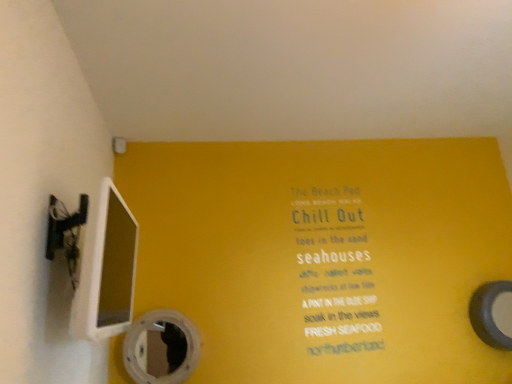
How much space does transparent plastic mirror at lower center, which is the 2th mirror from back to front, occupy horizontally?

transparent plastic mirror at lower center, which is the 2th mirror from back to front, is 6.31 inches in width.

Locate an element on the screen. transparent plastic mirror at lower center, which is the second mirror from right to left is located at coordinates (161, 348).

In order to face transparent plastic mirror at lower center, the first mirror from the front, should I rotate leftwards or rightwards?

Rotate your view left by about 12.433°.

Image resolution: width=512 pixels, height=384 pixels. What do you see at coordinates (161, 348) in the screenshot?
I see `transparent plastic mirror at lower center, which is the second mirror from right to left` at bounding box center [161, 348].

Measure the distance between point (505, 313) and camera.

The distance of point (505, 313) from camera is 8.27 feet.

Identify the location of smooth gray mirror at right, acting as the 1th mirror starting from the back. This screenshot has height=384, width=512. (493, 314).

What do you see at coordinates (493, 314) in the screenshot?
I see `smooth gray mirror at right, acting as the 1th mirror starting from the back` at bounding box center [493, 314].

The width and height of the screenshot is (512, 384). What are the coordinates of `transparent plastic mirror at lower center, which is the second mirror from right to left` in the screenshot? It's located at (161, 348).

Considering the relative positions of smooth gray mirror at right, placed as the second mirror when sorted from front to back, and transparent plastic mirror at lower center, which is the 2th mirror from back to front, in the image provided, is smooth gray mirror at right, placed as the second mirror when sorted from front to back, to the left of transparent plastic mirror at lower center, which is the 2th mirror from back to front, from the viewer's perspective?

Incorrect, smooth gray mirror at right, placed as the second mirror when sorted from front to back, is not on the left side of transparent plastic mirror at lower center, which is the 2th mirror from back to front.

Looking at this image, who is more distant, smooth gray mirror at right, which is counted as the first mirror, starting from the right, or transparent plastic mirror at lower center, the 1th mirror in the left-to-right sequence?

smooth gray mirror at right, which is counted as the first mirror, starting from the right, is further away from the camera.

Which is farther from the camera, (496,316) or (136,372)?

Positioned behind is point (496,316).

From the image's perspective, is smooth gray mirror at right, placed as the second mirror when sorted from front to back, on top of transparent plastic mirror at lower center, the 1th mirror in the left-to-right sequence?

Indeed, from the image's perspective, smooth gray mirror at right, placed as the second mirror when sorted from front to back, is shown above transparent plastic mirror at lower center, the 1th mirror in the left-to-right sequence.

From a real-world perspective, is smooth gray mirror at right, which is counted as the first mirror, starting from the right, beneath transparent plastic mirror at lower center, the 1th mirror in the left-to-right sequence?

Incorrect, from a real-world perspective, smooth gray mirror at right, which is counted as the first mirror, starting from the right, is higher than transparent plastic mirror at lower center, the 1th mirror in the left-to-right sequence.

Between smooth gray mirror at right, placed as the second mirror when sorted from front to back, and transparent plastic mirror at lower center, the first mirror from the front, which one has larger width?

With larger width is smooth gray mirror at right, placed as the second mirror when sorted from front to back.

Considering the relative sizes of smooth gray mirror at right, acting as the 1th mirror starting from the back, and transparent plastic mirror at lower center, which is the second mirror from right to left, in the image provided, is smooth gray mirror at right, acting as the 1th mirror starting from the back, taller than transparent plastic mirror at lower center, which is the second mirror from right to left,?

Yes, smooth gray mirror at right, acting as the 1th mirror starting from the back, is taller than transparent plastic mirror at lower center, which is the second mirror from right to left.

Who is bigger, smooth gray mirror at right, arranged as the second mirror when viewed from the left, or transparent plastic mirror at lower center, which is the second mirror from right to left?

Bigger between the two is transparent plastic mirror at lower center, which is the second mirror from right to left.

Which is correct: smooth gray mirror at right, placed as the second mirror when sorted from front to back, is inside transparent plastic mirror at lower center, the 1th mirror in the left-to-right sequence, or outside of it?

smooth gray mirror at right, placed as the second mirror when sorted from front to back, exists outside the volume of transparent plastic mirror at lower center, the 1th mirror in the left-to-right sequence.

Is smooth gray mirror at right, which is counted as the first mirror, starting from the right, not close to transparent plastic mirror at lower center, which is the second mirror from right to left?

Yes, smooth gray mirror at right, which is counted as the first mirror, starting from the right, is far from transparent plastic mirror at lower center, which is the second mirror from right to left.

Could you tell me if smooth gray mirror at right, arranged as the second mirror when viewed from the left, is turned towards transparent plastic mirror at lower center, the 1th mirror in the left-to-right sequence?

No, smooth gray mirror at right, arranged as the second mirror when viewed from the left, is not turned towards transparent plastic mirror at lower center, the 1th mirror in the left-to-right sequence.

Find the location of `mirror behind the transparent plastic mirror at lower center, which is the 2th mirror from back to front`. mirror behind the transparent plastic mirror at lower center, which is the 2th mirror from back to front is located at coordinates (493, 314).

In the scene shown: Is transparent plastic mirror at lower center, the 1th mirror in the left-to-right sequence, at the left side of smooth gray mirror at right, which is counted as the first mirror, starting from the right?

Correct, you'll find transparent plastic mirror at lower center, the 1th mirror in the left-to-right sequence, to the left of smooth gray mirror at right, which is counted as the first mirror, starting from the right.

Is the depth of transparent plastic mirror at lower center, the first mirror from the front, less than that of smooth gray mirror at right, which is counted as the first mirror, starting from the right?

Yes, transparent plastic mirror at lower center, the first mirror from the front, is in front of smooth gray mirror at right, which is counted as the first mirror, starting from the right.

Which point is more distant from viewer, (x=158, y=320) or (x=496, y=291)?

The point (x=496, y=291) is behind.

From the image's perspective, is transparent plastic mirror at lower center, the 1th mirror in the left-to-right sequence, beneath smooth gray mirror at right, which is counted as the first mirror, starting from the right?

Yes.

From a real-world perspective, between transparent plastic mirror at lower center, the 1th mirror in the left-to-right sequence, and smooth gray mirror at right, arranged as the second mirror when viewed from the left, who is vertically lower?

In real-world perspective, transparent plastic mirror at lower center, the 1th mirror in the left-to-right sequence, is lower.

Considering the relative sizes of transparent plastic mirror at lower center, the first mirror from the front, and smooth gray mirror at right, acting as the 1th mirror starting from the back, in the image provided, is transparent plastic mirror at lower center, the first mirror from the front, thinner than smooth gray mirror at right, acting as the 1th mirror starting from the back,?

Correct, the width of transparent plastic mirror at lower center, the first mirror from the front, is less than that of smooth gray mirror at right, acting as the 1th mirror starting from the back.

From their relative heights in the image, would you say transparent plastic mirror at lower center, the 1th mirror in the left-to-right sequence, is taller or shorter than smooth gray mirror at right, which is counted as the first mirror, starting from the right?

Clearly, transparent plastic mirror at lower center, the 1th mirror in the left-to-right sequence, is shorter compared to smooth gray mirror at right, which is counted as the first mirror, starting from the right.

Who is smaller, transparent plastic mirror at lower center, which is the 2th mirror from back to front, or smooth gray mirror at right, which is counted as the first mirror, starting from the right?

smooth gray mirror at right, which is counted as the first mirror, starting from the right, is smaller.

Looking at this image, can smooth gray mirror at right, arranged as the second mirror when viewed from the left, be found inside transparent plastic mirror at lower center, which is the second mirror from right to left?

No, transparent plastic mirror at lower center, which is the second mirror from right to left, does not contain smooth gray mirror at right, arranged as the second mirror when viewed from the left.

Based on the photo, is transparent plastic mirror at lower center, which is the 2th mirror from back to front, beside smooth gray mirror at right, which is counted as the first mirror, starting from the right?

No.

Is transparent plastic mirror at lower center, the 1th mirror in the left-to-right sequence, facing towards smooth gray mirror at right, which is counted as the first mirror, starting from the right?

No, transparent plastic mirror at lower center, the 1th mirror in the left-to-right sequence, is not facing towards smooth gray mirror at right, which is counted as the first mirror, starting from the right.

Can you tell me how much transparent plastic mirror at lower center, the first mirror from the front, and smooth gray mirror at right, arranged as the second mirror when viewed from the left, differ in facing direction?

transparent plastic mirror at lower center, the first mirror from the front, and smooth gray mirror at right, arranged as the second mirror when viewed from the left, are facing 1.43 degrees away from each other.

You are a GUI agent. You are given a task and a screenshot of the screen. Output one action in this format:
    pyautogui.click(x=<x>, y=<y>)
    Task: Click on the mirror that is under the smooth gray mirror at right, arranged as the second mirror when viewed from the left (from a real-world perspective)
    
    Given the screenshot: What is the action you would take?
    pyautogui.click(x=161, y=348)

Locate an element on the screen. The height and width of the screenshot is (384, 512). mirror directly beneath the smooth gray mirror at right, arranged as the second mirror when viewed from the left (from a real-world perspective) is located at coordinates (161, 348).

Where is `mirror that appears in front of the smooth gray mirror at right, arranged as the second mirror when viewed from the left`? The width and height of the screenshot is (512, 384). mirror that appears in front of the smooth gray mirror at right, arranged as the second mirror when viewed from the left is located at coordinates (161, 348).